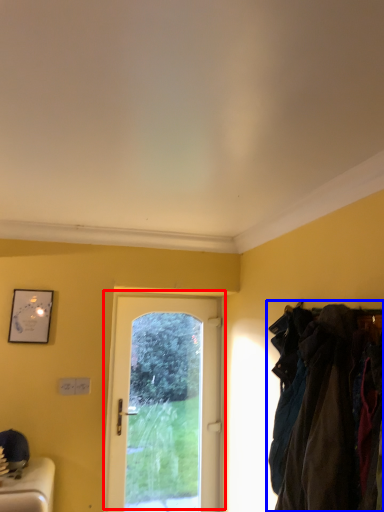
Question: Among these objects, which one is farthest to the camera, door (highlighted by a red box) or laundry (highlighted by a blue box)?

Choices:
 (A) door
 (B) laundry

Answer: (A)